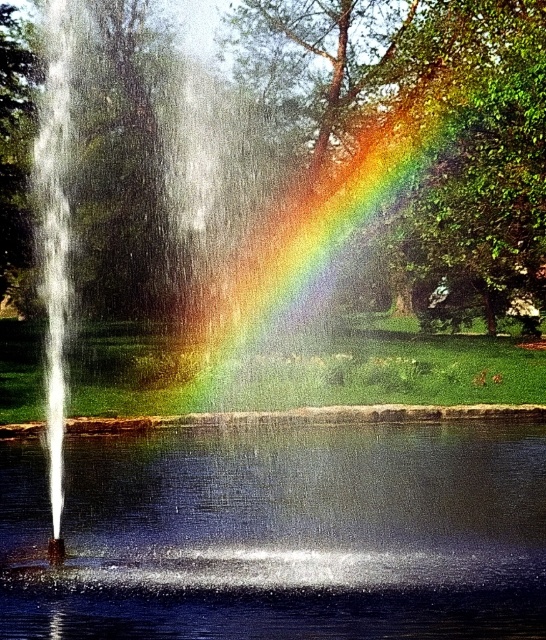
You are standing in the scene and want to take a photo of the transparent glass lake at center. Where should you position yourself to capture it in the frame?

To capture the transparent glass lake at center in the frame, position yourself so that the lake is centered at the coordinates point (281, 532).